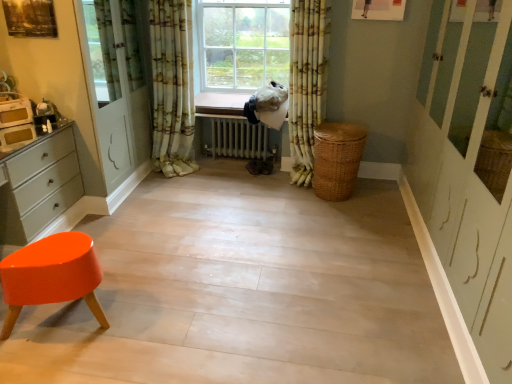
Question: Is matte white chest of drawers at left at the right side of woven brown basket at lower right?

Choices:
 (A) no
 (B) yes

Answer: (A)

Question: Considering the relative sizes of matte white chest of drawers at left and woven brown basket at lower right in the image provided, is matte white chest of drawers at left thinner than woven brown basket at lower right?

Choices:
 (A) no
 (B) yes

Answer: (B)

Question: Can you confirm if matte white chest of drawers at left is smaller than woven brown basket at lower right?

Choices:
 (A) no
 (B) yes

Answer: (A)

Question: Is woven brown basket at lower right inside matte white chest of drawers at left?

Choices:
 (A) no
 (B) yes

Answer: (A)

Question: Is matte white chest of drawers at left facing towards woven brown basket at lower right?

Choices:
 (A) no
 (B) yes

Answer: (B)

Question: Can you confirm if matte white chest of drawers at left is taller than woven brown basket at lower right?

Choices:
 (A) yes
 (B) no

Answer: (A)

Question: From a real-world perspective, is matte white toaster at left positioned over floral fabric curtain at center, which is the second curtain in left-to-right order, based on gravity?

Choices:
 (A) no
 (B) yes

Answer: (B)

Question: From a real-world perspective, does matte white toaster at left sit lower than floral fabric curtain at center, which is the second curtain in left-to-right order?

Choices:
 (A) no
 (B) yes

Answer: (A)

Question: Does matte white toaster at left have a greater height compared to floral fabric curtain at center, placed as the 1th curtain when sorted from right to left?

Choices:
 (A) yes
 (B) no

Answer: (B)

Question: Is matte white toaster at left oriented towards floral fabric curtain at center, placed as the 1th curtain when sorted from right to left?

Choices:
 (A) yes
 (B) no

Answer: (B)

Question: Is matte white toaster at left thinner than floral fabric curtain at center, placed as the 1th curtain when sorted from right to left?

Choices:
 (A) yes
 (B) no

Answer: (A)

Question: Is matte white toaster at left not inside floral fabric curtain at center, placed as the 1th curtain when sorted from right to left?

Choices:
 (A) no
 (B) yes

Answer: (B)

Question: Are white metallic radiator at center and floral fabric curtain at center, placed as the second curtain when sorted from right to left, located far from each other?

Choices:
 (A) yes
 (B) no

Answer: (B)